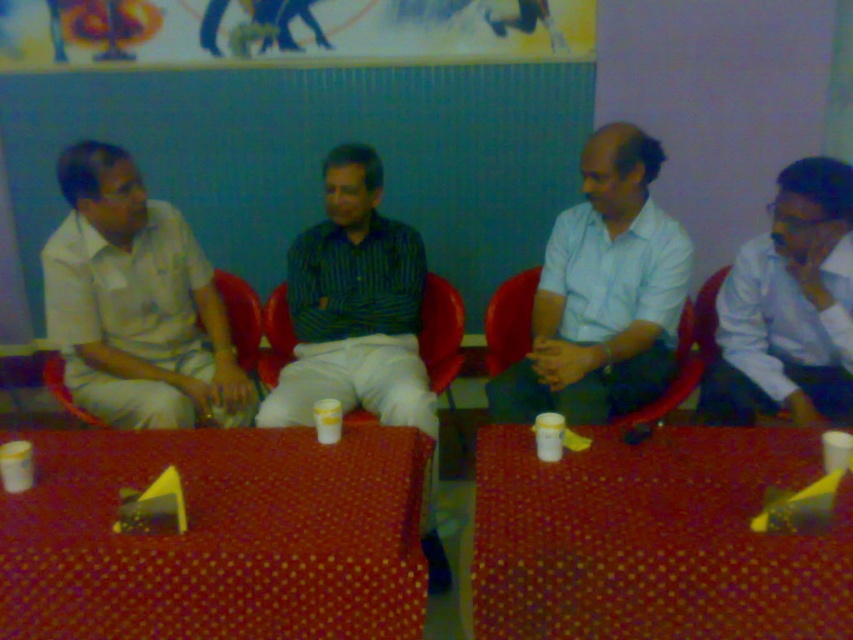
Who is shorter, white shirt at right or matte plastic chair at center?

With less height is matte plastic chair at center.

Which is behind, point (827, 163) or point (277, 307)?

Point (277, 307)

At what (x,y) coordinates should I click in order to perform the action: click on white shirt at right. Please return your answer as a coordinate pair (x, y). Looking at the image, I should click on (788, 307).

Who is more distant from viewer, (68, 150) or (312, 326)?

Positioned behind is point (312, 326).

Is white matte shirt at left thinner than striped cotton shirt at center?

Incorrect, white matte shirt at left's width is not less than striped cotton shirt at center's.

Is point (78, 384) closer to camera compared to point (354, 280)?

Yes, it is.

What are the coordinates of `white matte shirt at left` in the screenshot? It's located at (136, 304).

Does red dotted table at center lie in front of white matte shirt at left?

Yes, red dotted table at center is in front of white matte shirt at left.

Can you confirm if red dotted table at center is taller than white matte shirt at left?

Incorrect, red dotted table at center's height is not larger of white matte shirt at left's.

Which is behind, point (515, 522) or point (106, 364)?

The point (106, 364) is behind.

Where is `red dotted table at center`? Image resolution: width=853 pixels, height=640 pixels. red dotted table at center is located at coordinates (653, 540).